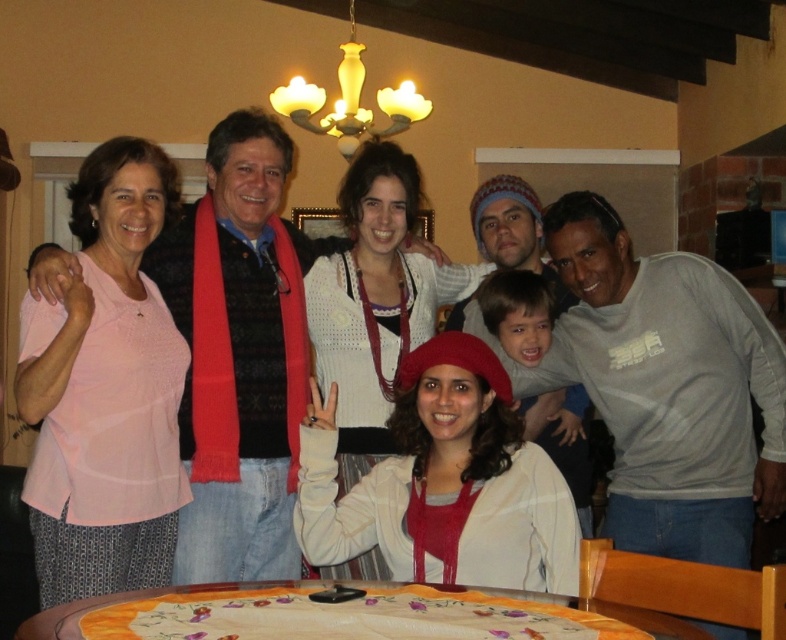
Question: From the image, what is the correct spatial relationship of gray cotton shirt at center in relation to ivory matte chandelier at upper center?

Choices:
 (A) below
 (B) above

Answer: (A)

Question: Which is nearer to the pink fabric shirt at left?

Choices:
 (A) embroidered fabric table at center
 (B) ivory matte chandelier at upper center

Answer: (A)

Question: Considering the relative positions of pink fabric shirt at left and embroidered fabric table at center in the image provided, where is pink fabric shirt at left located with respect to embroidered fabric table at center?

Choices:
 (A) above
 (B) below

Answer: (A)

Question: Which is farther from the ivory matte chandelier at upper center?

Choices:
 (A) embroidered fabric table at center
 (B) gray cotton shirt at center

Answer: (A)

Question: Is gray cotton shirt at center closer to the viewer compared to pink fabric shirt at left?

Choices:
 (A) no
 (B) yes

Answer: (B)

Question: Among these objects, which one is farthest from the camera?

Choices:
 (A) pink fabric shirt at left
 (B) gray cotton shirt at center
 (C) ivory matte chandelier at upper center

Answer: (C)